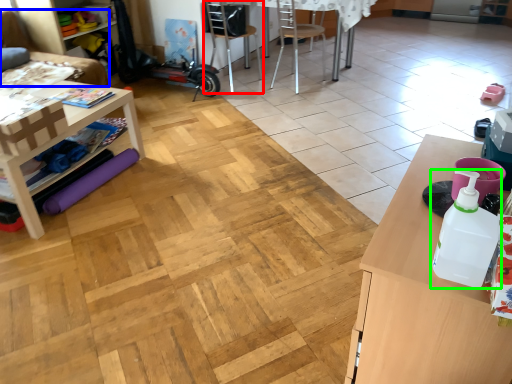
Question: Considering the real-world distances, which object is farthest from chair (highlighted by a red box)? couch (highlighted by a blue box) or bottle (highlighted by a green box)?

Choices:
 (A) couch
 (B) bottle

Answer: (B)